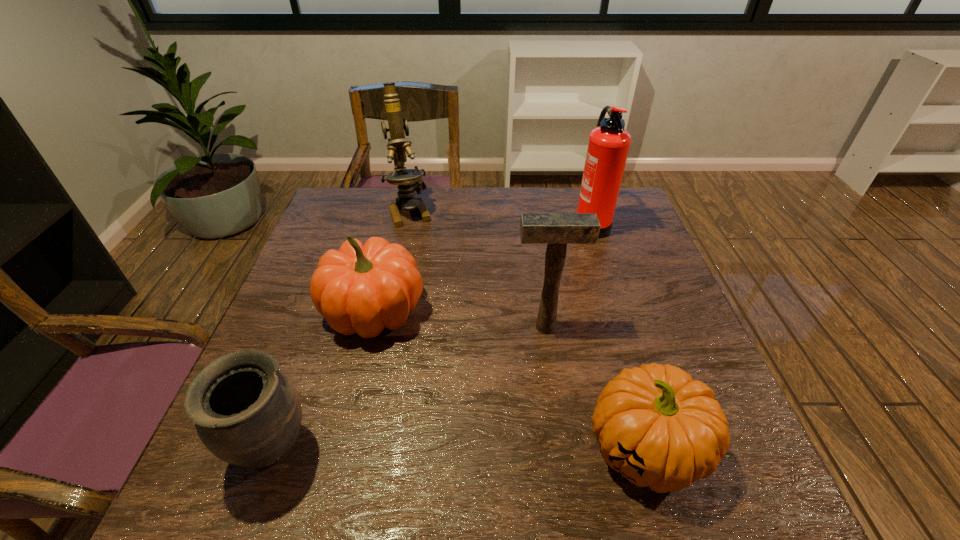
You are a GUI agent. You are given a task and a screenshot of the screen. Output one action in this format:
    pyautogui.click(x=<x>, y=<y>)
    Task: Click on the vacant space at the near edge of the desktop
    The width and height of the screenshot is (960, 540).
    Given the screenshot: What is the action you would take?
    pyautogui.click(x=395, y=502)

Find the location of a particular element. This screenshot has height=540, width=960. vacant space at the left edge of the desktop is located at coordinates (310, 316).

This screenshot has width=960, height=540. I want to click on free space at the right edge of the desktop, so click(629, 246).

This screenshot has height=540, width=960. Find the location of `free spot at the far left corner of the desktop`. free spot at the far left corner of the desktop is located at coordinates (362, 194).

Identify the location of free space at the far right corner. (621, 196).

Find the location of a particular element. vacant space that is in between the urn and the nearer pumpkin is located at coordinates (459, 450).

Where is `blank region between the urn and the fire extinguisher`? Image resolution: width=960 pixels, height=540 pixels. blank region between the urn and the fire extinguisher is located at coordinates pyautogui.click(x=432, y=337).

Locate an element on the screen. vacant space that's between the fire extinguisher and the microscope is located at coordinates (500, 217).

Find the location of a particular element. The height and width of the screenshot is (540, 960). free spot between the third tallest object and the fire extinguisher is located at coordinates (567, 275).

Where is `vacant space that is in between the fire extinguisher and the right pumpkin`? vacant space that is in between the fire extinguisher and the right pumpkin is located at coordinates pos(617,336).